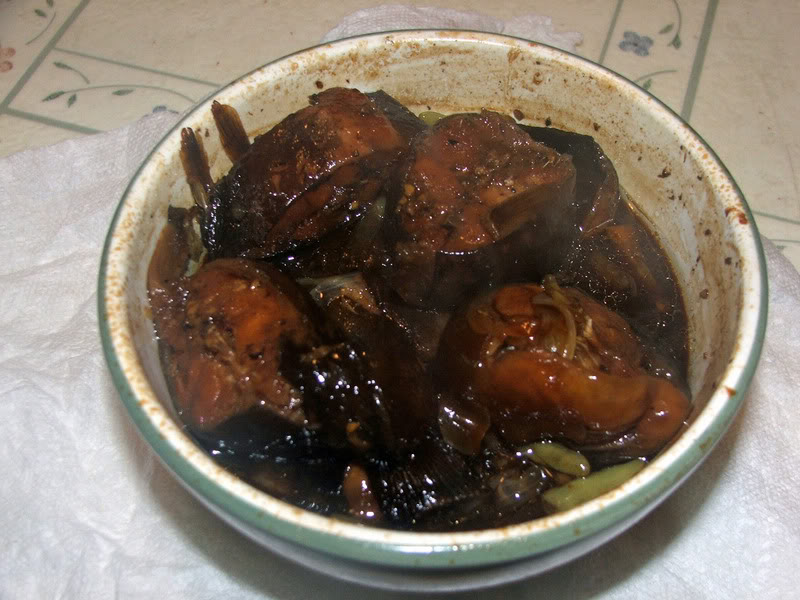
I want to click on floor, so click(238, 42).